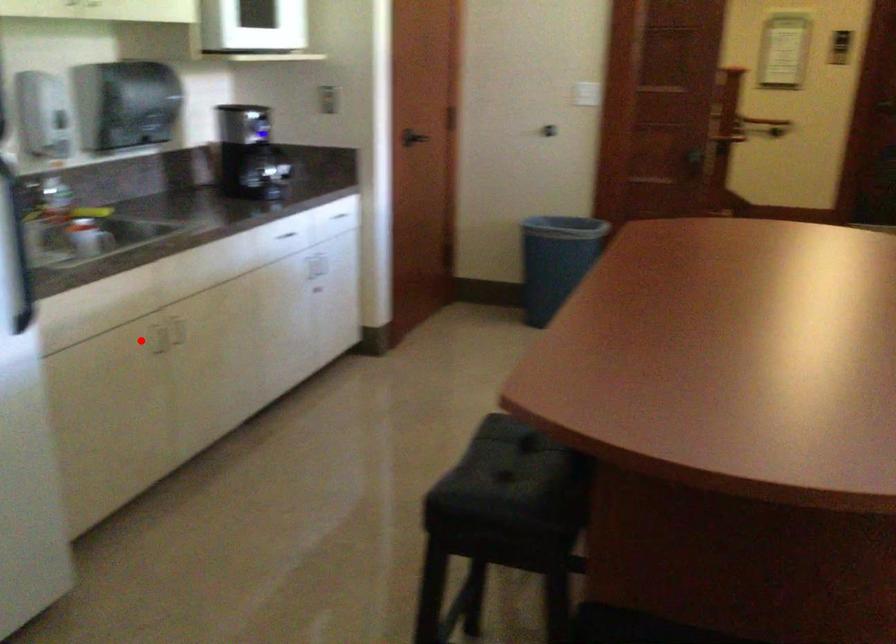
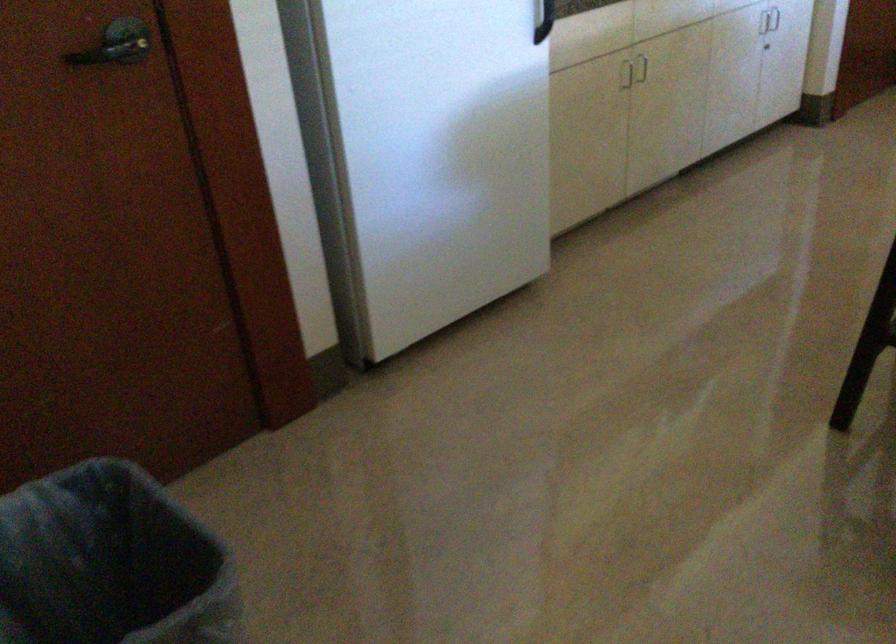
In the second image, find the point that corresponds to the highlighted location in the first image.

(625, 75)